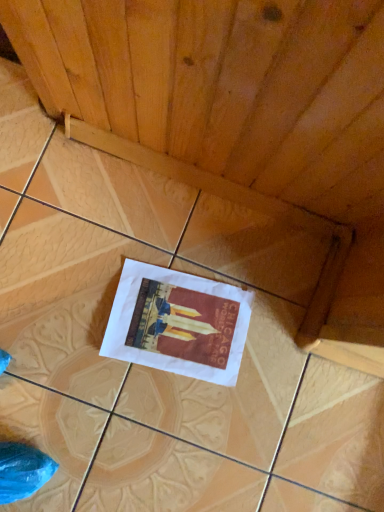
This screenshot has height=512, width=384. I want to click on empty space that is ontop of wooden at center (from a real-world perspective), so click(x=164, y=318).